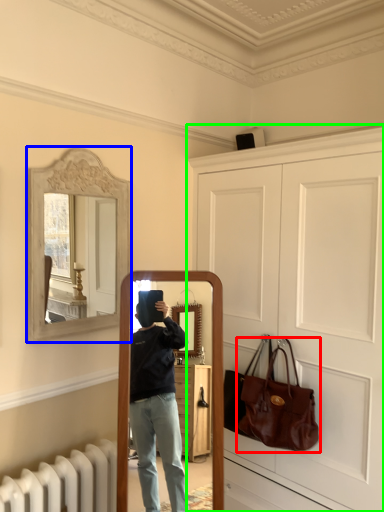
Question: Considering the real-world distances, which object is farthest from handbag (highlighted by a red box)? picture frame (highlighted by a blue box) or door (highlighted by a green box)?

Choices:
 (A) picture frame
 (B) door

Answer: (A)